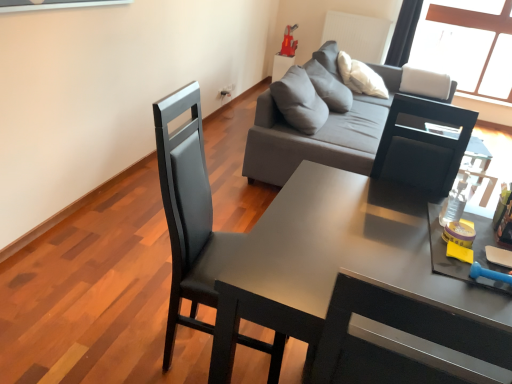
Question: Is rubberized red toy at upper center taller than gray fabric side table at upper center?

Choices:
 (A) yes
 (B) no

Answer: (B)

Question: Does rubberized red toy at upper center have a smaller size compared to gray fabric side table at upper center?

Choices:
 (A) no
 (B) yes

Answer: (B)

Question: Are rubberized red toy at upper center and gray fabric side table at upper center located far from each other?

Choices:
 (A) no
 (B) yes

Answer: (A)

Question: Is rubberized red toy at upper center not within gray fabric side table at upper center?

Choices:
 (A) no
 (B) yes

Answer: (B)

Question: Could gray fabric side table at upper center be considered to be inside rubberized red toy at upper center?

Choices:
 (A) no
 (B) yes

Answer: (A)

Question: Is rubberized red toy at upper center facing towards gray fabric side table at upper center?

Choices:
 (A) yes
 (B) no

Answer: (B)

Question: From a real-world perspective, is gray fabric couch at upper center over matte black desk at center?

Choices:
 (A) no
 (B) yes

Answer: (B)

Question: Is the position of gray fabric couch at upper center more distant than that of matte black desk at center?

Choices:
 (A) no
 (B) yes

Answer: (B)

Question: Does gray fabric couch at upper center come in front of matte black desk at center?

Choices:
 (A) no
 (B) yes

Answer: (A)

Question: Is gray fabric couch at upper center completely or partially outside of matte black desk at center?

Choices:
 (A) yes
 (B) no

Answer: (A)

Question: Is gray fabric couch at upper center positioned with its back to matte black desk at center?

Choices:
 (A) no
 (B) yes

Answer: (A)

Question: Is gray fabric couch at upper center aimed at matte black desk at center?

Choices:
 (A) no
 (B) yes

Answer: (A)

Question: Is gray fabric side table at upper center positioned beyond the bounds of matte black chair at center-left?

Choices:
 (A) no
 (B) yes

Answer: (B)